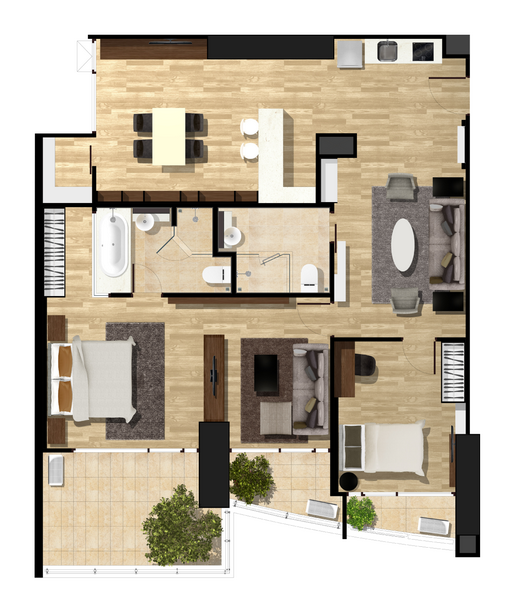
Locate an element on the screen. toilet is located at coordinates (213, 281).